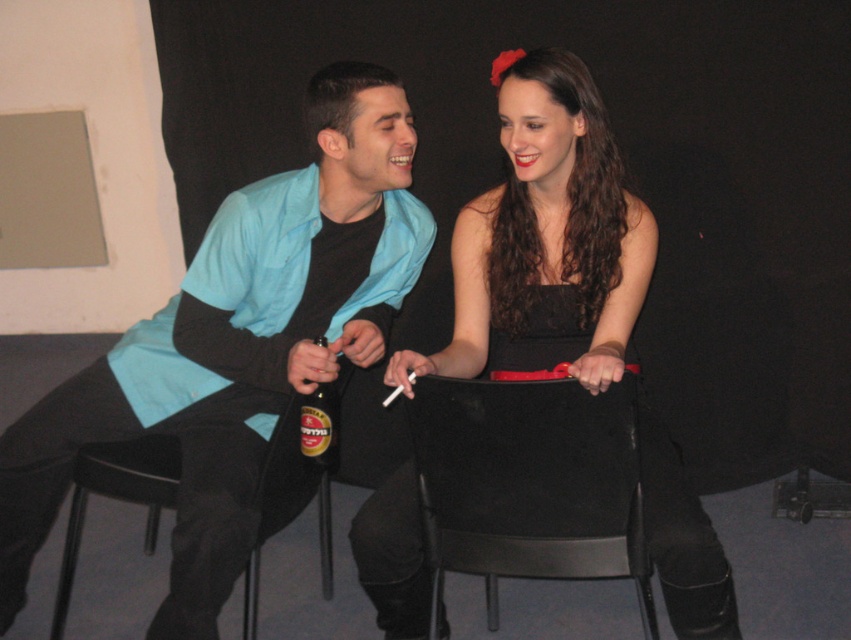
You are designing a seating arrangement for a small event and need to ensure that the matte blue shirt at left and the black fabric chair at center can be placed in a space that accommodates both. Given their sizes, which object requires more space in the arrangement?

The matte blue shirt at left requires more space in the arrangement because it has a larger size compared to the black fabric chair at center.